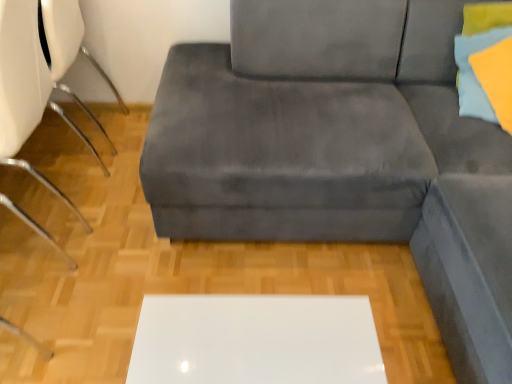
Question: Is white glossy table at center aimed at white plastic chair at left?

Choices:
 (A) yes
 (B) no

Answer: (B)

Question: Considering the relative sizes of white glossy table at center and white plastic chair at left in the image provided, is white glossy table at center thinner than white plastic chair at left?

Choices:
 (A) no
 (B) yes

Answer: (B)

Question: Is white glossy table at center next to white plastic chair at left?

Choices:
 (A) no
 (B) yes

Answer: (A)

Question: Does white glossy table at center have a greater width compared to white plastic chair at left?

Choices:
 (A) yes
 (B) no

Answer: (B)

Question: Would you say white glossy table at center is a long distance from white plastic chair at left?

Choices:
 (A) no
 (B) yes

Answer: (A)

Question: Can you confirm if white glossy table at center is positioned to the left of white plastic chair at left?

Choices:
 (A) yes
 (B) no

Answer: (B)

Question: Is the position of velvet gray couch at center more distant than that of white glossy table at center?

Choices:
 (A) yes
 (B) no

Answer: (A)

Question: Is velvet gray couch at center shorter than white glossy table at center?

Choices:
 (A) yes
 (B) no

Answer: (A)

Question: Does velvet gray couch at center have a lesser width compared to white glossy table at center?

Choices:
 (A) yes
 (B) no

Answer: (B)

Question: Is velvet gray couch at center to the right of white glossy table at center from the viewer's perspective?

Choices:
 (A) no
 (B) yes

Answer: (A)

Question: Could white glossy table at center be considered to be inside velvet gray couch at center?

Choices:
 (A) no
 (B) yes

Answer: (A)

Question: Can you confirm if velvet gray couch at center is taller than white glossy table at center?

Choices:
 (A) no
 (B) yes

Answer: (A)

Question: Does velvet gray couch at center have a larger size compared to white plastic chair at left?

Choices:
 (A) yes
 (B) no

Answer: (B)